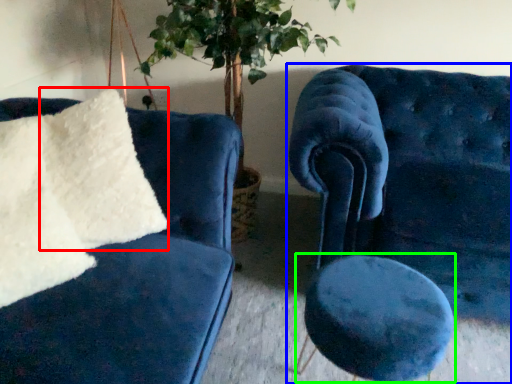
Question: Which object is the farthest from pillow (highlighted by a red box)? Choose among these: chair (highlighted by a blue box) or stool (highlighted by a green box).

Choices:
 (A) chair
 (B) stool

Answer: (A)